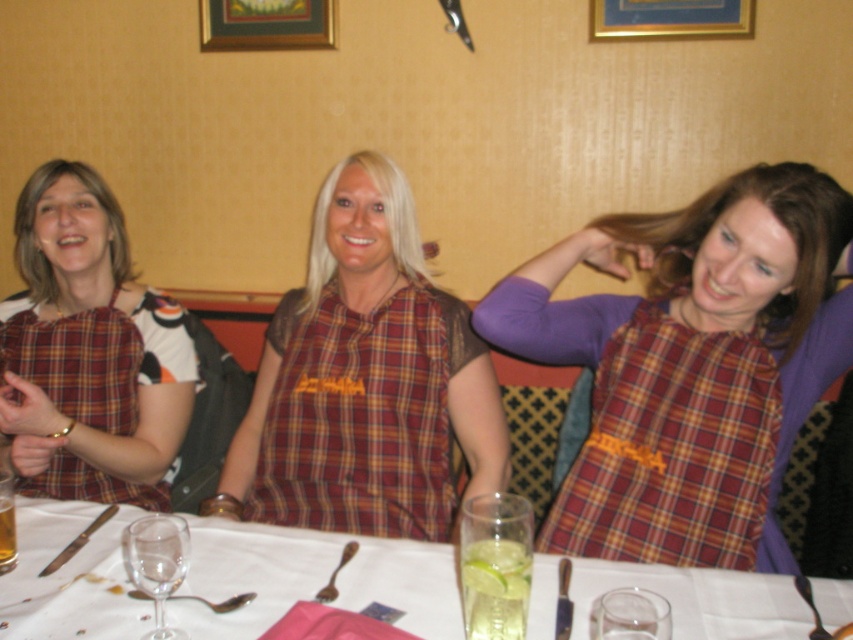
Is the position of plaid fabric dress at center less distant than that of plaid fabric dress at left?

Yes, it is in front of plaid fabric dress at left.

Is plaid fabric dress at center below plaid fabric dress at left?

Yes, plaid fabric dress at center is below plaid fabric dress at left.

Is point (775, 444) positioned in front of point (68, 323)?

Yes, point (775, 444) is in front of point (68, 323).

Image resolution: width=853 pixels, height=640 pixels. I want to click on plaid fabric dress at center, so click(x=691, y=369).

Who is shorter, plaid fabric dress at center or clear glass at center?

Standing shorter between the two is clear glass at center.

Measure the distance from plaid fabric dress at center to clear glass at center.

They are 17.35 inches apart.

The width and height of the screenshot is (853, 640). Find the location of `plaid fabric dress at center`. plaid fabric dress at center is located at coordinates (691, 369).

Does plaid fabric dress at center have a larger size compared to clear glass wine glass at center?

Yes, plaid fabric dress at center is bigger than clear glass wine glass at center.

Which is behind, point (798, 298) or point (161, 566)?

The point (798, 298) is more distant.

I want to click on plaid fabric dress at center, so click(691, 369).